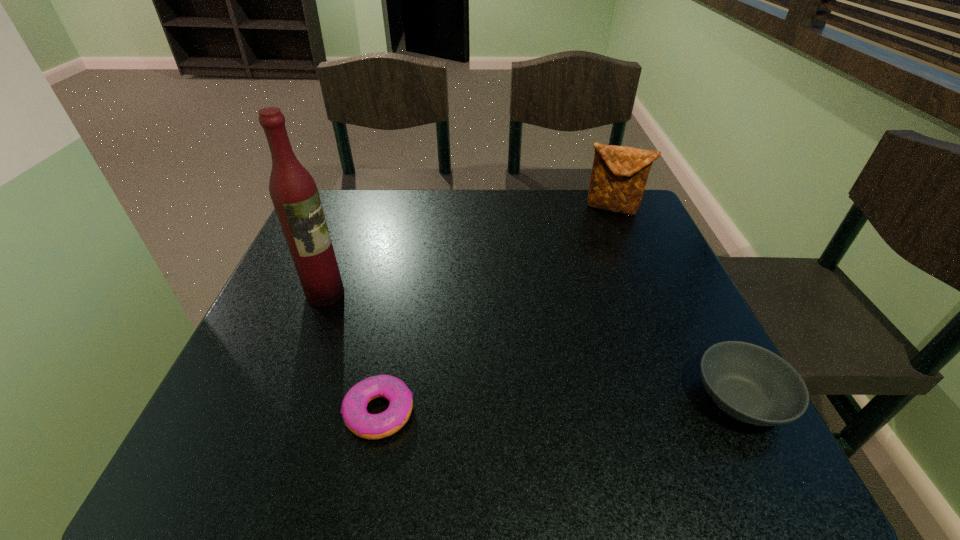
Locate an element on the screen. The height and width of the screenshot is (540, 960). the third object from right to left is located at coordinates (363, 424).

Locate an element on the screen. This screenshot has width=960, height=540. doughnut is located at coordinates (363, 424).

Where is `soup bowl`? Image resolution: width=960 pixels, height=540 pixels. soup bowl is located at coordinates (749, 383).

What are the coordinates of `the leftmost object` in the screenshot? It's located at (293, 191).

The height and width of the screenshot is (540, 960). I want to click on the third nearest object, so click(293, 191).

Image resolution: width=960 pixels, height=540 pixels. I want to click on the farthest object, so click(x=619, y=175).

Locate an element on the screen. the second tallest object is located at coordinates (619, 175).

This screenshot has height=540, width=960. I want to click on blank space located 0.310m on the back of the third object from right to left, so click(x=407, y=269).

Locate an element on the screen. free space located 0.280m on the back of the second shortest object is located at coordinates (671, 265).

Image resolution: width=960 pixels, height=540 pixels. What are the coordinates of `vacant space situated on the label of the third nearest object` in the screenshot? It's located at (407, 340).